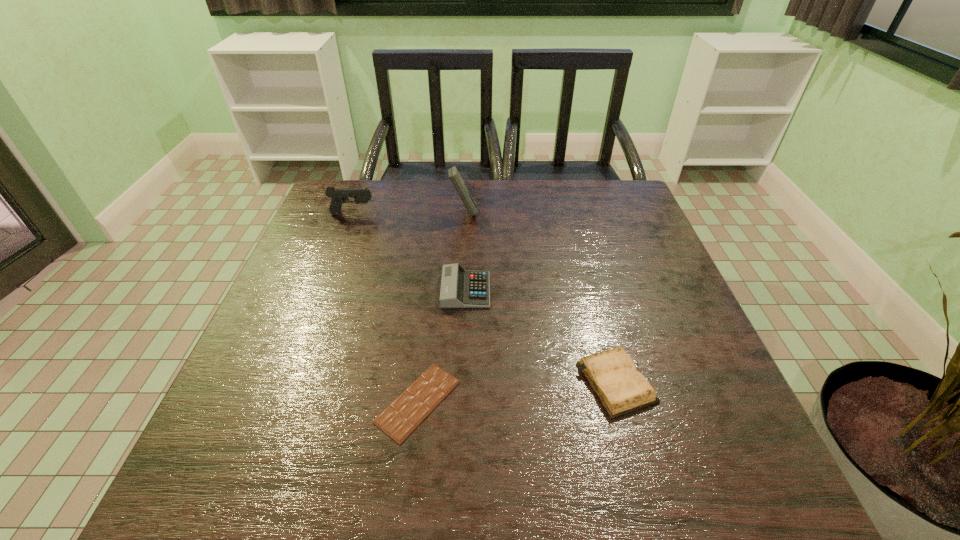
Find the location of a particular element. This screenshot has height=540, width=960. free space that satisfies the following two spatial constraints: 1. at the barrel of the pistol; 2. on the left side of the nearer calculator is located at coordinates (324, 290).

The image size is (960, 540). I want to click on vacant area that satisfies the following two spatial constraints: 1. at the barrel of the pistol; 2. on the left side of the shortest object, so click(x=281, y=401).

This screenshot has height=540, width=960. I want to click on vacant space that satisfies the following two spatial constraints: 1. at the barrel of the second tallest object; 2. on the left side of the rightmost object, so click(288, 382).

In order to click on vacant space that satisfies the following two spatial constraints: 1. on the front-facing side of the taller calculator; 2. on the back side of the third shortest object in this screenshot , I will do `click(460, 290)`.

This screenshot has height=540, width=960. I want to click on vacant region that satisfies the following two spatial constraints: 1. at the barrel of the shorter calculator; 2. on the right side of the pistol, so click(x=324, y=290).